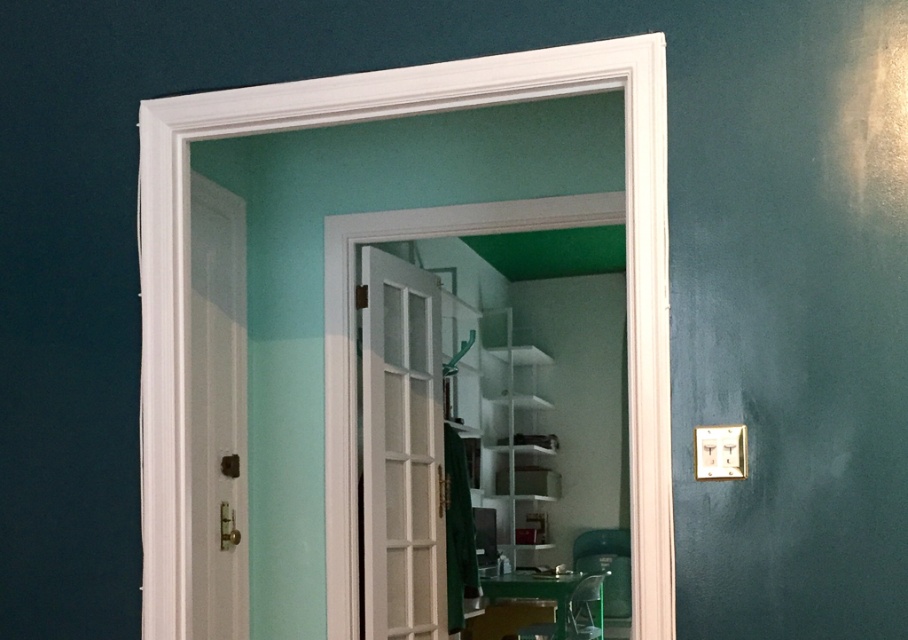
Question: Which point is closer to the camera?

Choices:
 (A) clear plastic chair at center
 (B) white glossy door at left

Answer: (B)

Question: Estimate the real-world distances between objects in this image. Which object is farther from the white glossy bookshelf at center?

Choices:
 (A) white glossy door at left
 (B) clear plastic chair at center

Answer: (A)

Question: Which of the following is the closest to the observer?

Choices:
 (A) white glossy door at left
 (B) white glossy bookshelf at center
 (C) clear plastic chair at center

Answer: (A)

Question: Is white glossy door at center thinner than clear plastic chair at center?

Choices:
 (A) no
 (B) yes

Answer: (B)

Question: Can you confirm if white glossy door at center is positioned to the left of clear plastic chair at center?

Choices:
 (A) yes
 (B) no

Answer: (A)

Question: Does white glossy door at left appear under clear plastic chair at center?

Choices:
 (A) yes
 (B) no

Answer: (B)